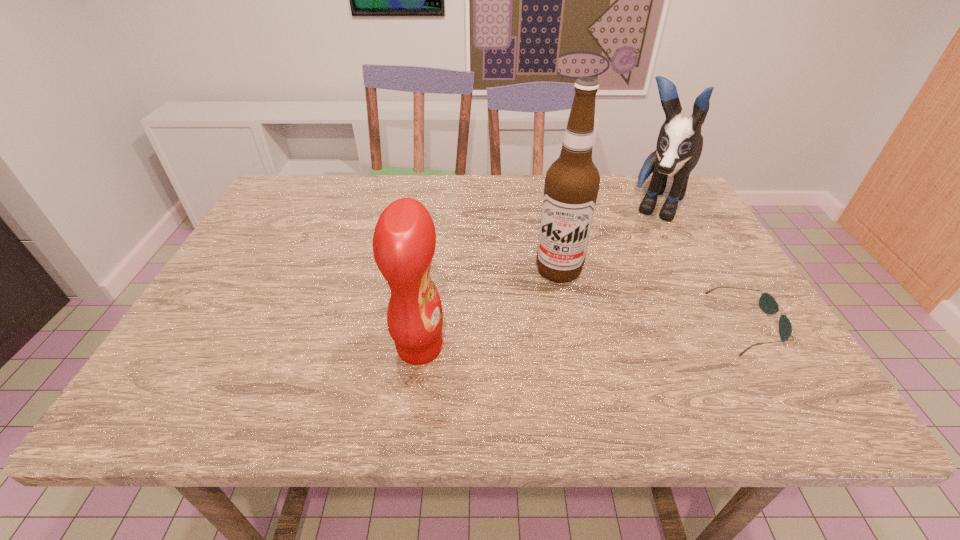
I want to click on object present at the near right corner, so click(767, 303).

This screenshot has width=960, height=540. Identify the location of blank area at the far edge. (454, 185).

The image size is (960, 540). I want to click on vacant space at the near edge of the desktop, so click(x=611, y=374).

Identify the location of vacant area at the left edge of the desktop. (255, 323).

Image resolution: width=960 pixels, height=540 pixels. In order to click on vacant space at the right edge of the desktop in this screenshot , I will do `click(747, 306)`.

At what (x,y) coordinates should I click in order to perform the action: click on free space at the far left corner. Please return your answer as a coordinate pair (x, y). The image size is (960, 540). Looking at the image, I should click on (308, 180).

This screenshot has width=960, height=540. What are the coordinates of `blank space at the near left corner` in the screenshot? It's located at (161, 370).

The width and height of the screenshot is (960, 540). Find the location of `free spot between the second farthest object and the condiment`. free spot between the second farthest object and the condiment is located at coordinates (490, 309).

Identify the location of free point between the third shortest object and the second shortest object. (538, 276).

Find the location of `free space that is in between the second farthest object and the shortest object`. free space that is in between the second farthest object and the shortest object is located at coordinates (653, 297).